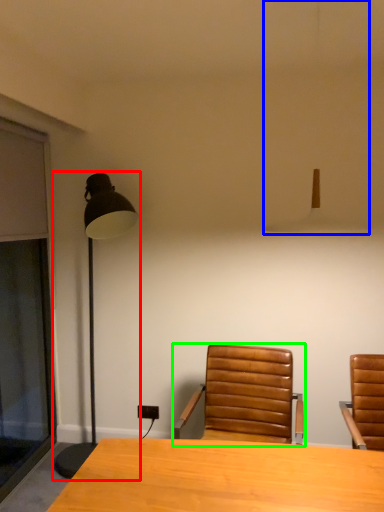
Question: Estimate the real-world distances between objects in this image. Which object is closer to lamp (highlighted by a red box), lamp (highlighted by a blue box) or chair (highlighted by a green box)?

Choices:
 (A) lamp
 (B) chair

Answer: (A)